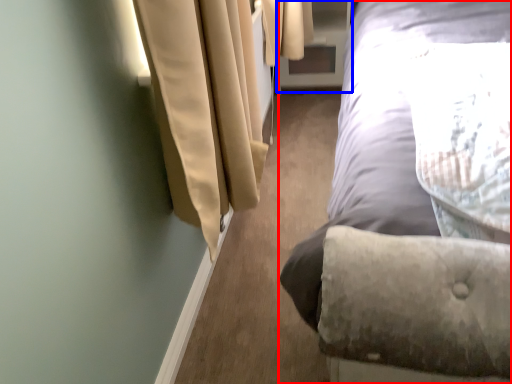
Question: Which of the following is the closest to the observer, bed (highlighted by a red box) or screen door (highlighted by a blue box)?

Choices:
 (A) bed
 (B) screen door

Answer: (A)